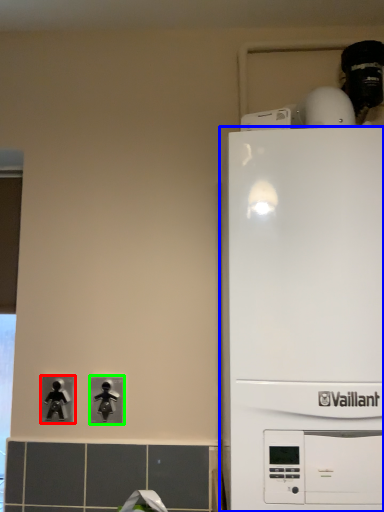
Question: Considering the real-world distances, which object is closest to light switch (highlighted by a red box)? home appliance (highlighted by a blue box) or light switch (highlighted by a green box).

Choices:
 (A) home appliance
 (B) light switch

Answer: (B)